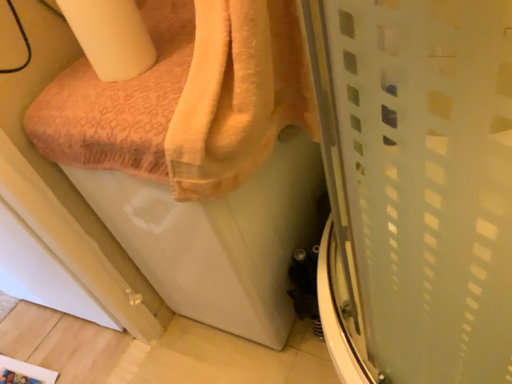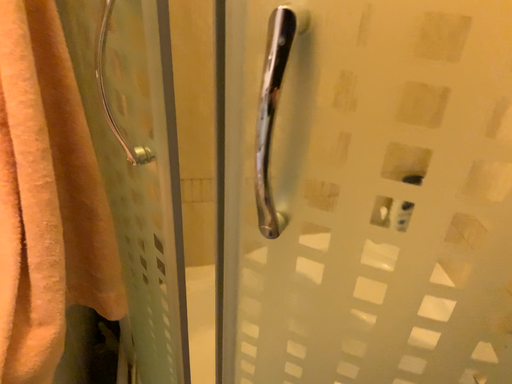
Question: Which way did the camera rotate in the video?

Choices:
 (A) rotated left
 (B) rotated right

Answer: (B)